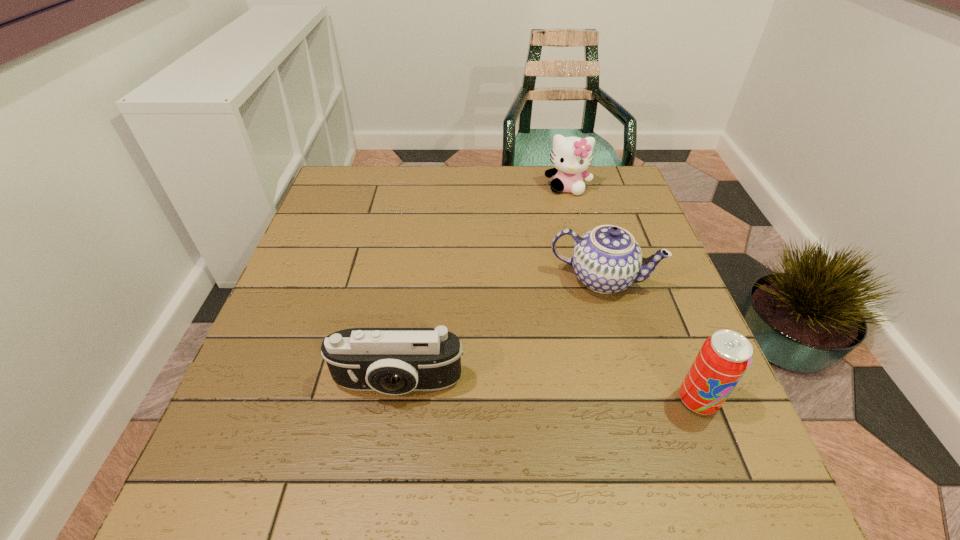
I want to click on vacant space on the desktop that is between the camera and the soda can and is positioned at the spout of the third nearest object, so click(571, 393).

In order to click on vacant space on the desktop that is between the camera and the soda can and is positioned on the front-facing side of the farthest object in this screenshot , I will do `click(558, 393)`.